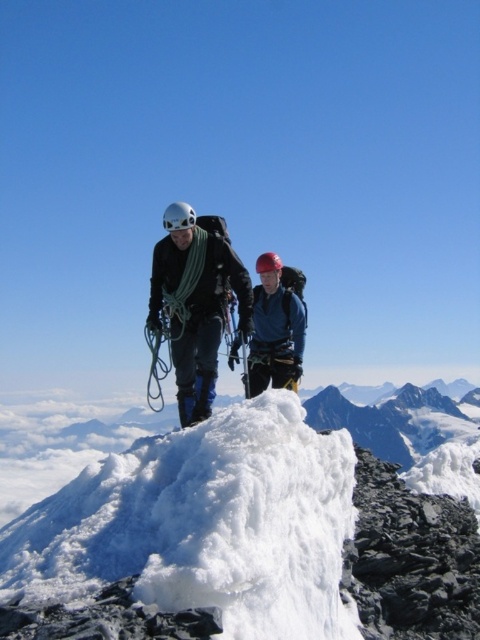
You are a photographer standing at the camera position. You want to take a photo of the point at coordinates point (303, 472). The camera has a focal length of 50mm and an aperture of f2.8. What is the minimum distance you need to move forward to ensure the point fills the frame vertically?

The point at coordinates point (303, 472) is 18.53 meters away from the camera. To calculate the minimum distance to move forward, we need to determine the required distance for the point to fill the frame vertically. However, without knowing the sensor size and the desired vertical coverage, an exact calculation isn

You are a mountain rescue team member trying to locate the climber wearing the matte black jacket at center. The rescue drone has a maximum operational distance of 25 meters. Can the drone safely reach the climber?

The matte black jacket at center is 23.71 meters away from camera, so yes, the drone can safely reach the climber as the distance is within the operational range of 25 meters.

You are a drone operator tasked with capturing aerial footage of two points on a mountain ridge. The points are labeled as point (x=427, y=592) and point (x=227, y=234). According to the scene, which point is closer to the camera?

Point (x=427, y=592) is closer to the camera than point (x=227, y=234).